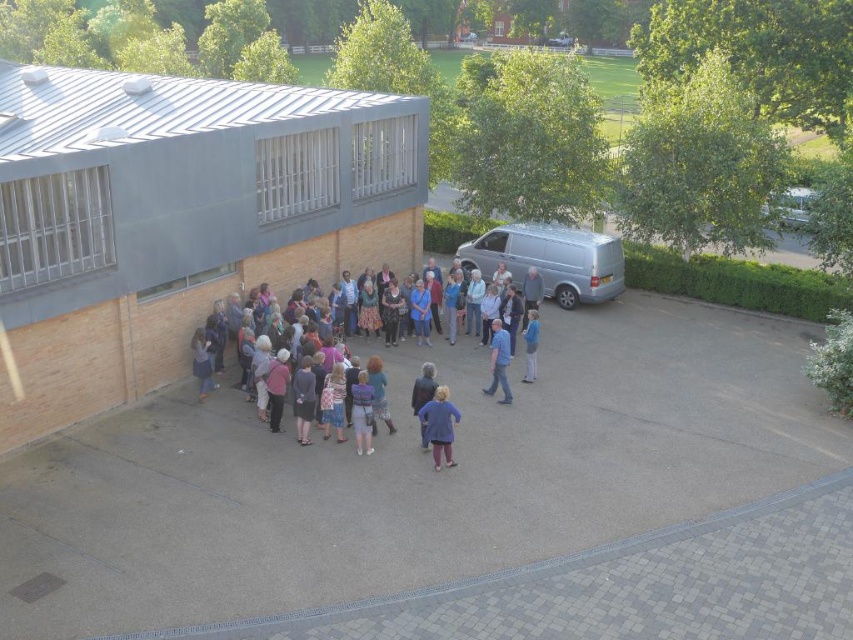
You are a photographer trying to capture a group photo of the purple fabric jacket at center and the blue fabric shirt at center. Since you want both subjects to appear equally sized in the photo, which subject should you move closer to the camera?

The purple fabric jacket at center has a larger width than the blue fabric shirt at center. To make them appear equally sized in the photo, you should move the blue fabric shirt at center closer to the camera since it is smaller and needs to be magnified more to match the size of the purple fabric jacket at center.

You are a delivery person who needs to park your 2.5 meter wide truck next to the silver metallic van at center. The parking space is only 5 meters wide. Considering the multicolored casual attire at center is also occupying some space, can your truck fit in the remaining space?

The silver metallic van at center is wider than the multicolored casual attire at center. Since the parking space is 5 meters wide and your truck is 2.5 meters wide, subtracting the van and attire widths would leave enough space for the truck. However, exact dimensions are unknown, so it depends on how much space remains after accounting for both objects.